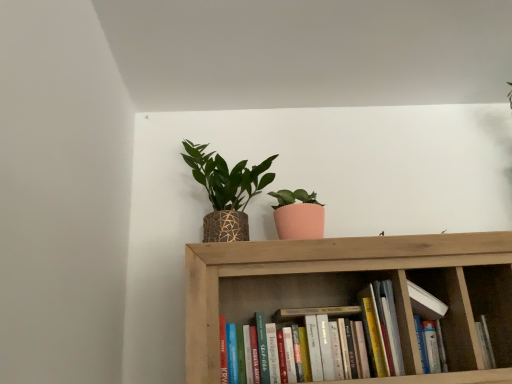
Question: Can we say wooden bookshelf at center lies outside textured woven pot at upper center?

Choices:
 (A) yes
 (B) no

Answer: (A)

Question: Does wooden bookshelf at center appear on the left side of textured woven pot at upper center?

Choices:
 (A) no
 (B) yes

Answer: (A)

Question: Is wooden bookshelf at center bigger than textured woven pot at upper center?

Choices:
 (A) no
 (B) yes

Answer: (B)

Question: Can you confirm if wooden bookshelf at center is shorter than textured woven pot at upper center?

Choices:
 (A) no
 (B) yes

Answer: (B)

Question: Is textured woven pot at upper center completely or partially inside wooden bookshelf at center?

Choices:
 (A) yes
 (B) no

Answer: (B)

Question: Is wooden bookshelf at center looking in the opposite direction of textured woven pot at upper center?

Choices:
 (A) no
 (B) yes

Answer: (A)

Question: Is hardcover books at center, placed as the 2th book when sorted from right to left, turned away from white matte book at center, which ranks as the 2th book in left-to-right order?

Choices:
 (A) yes
 (B) no

Answer: (B)

Question: Would you say white matte book at center, positioned as the first book in right-to-left order, is part of hardcover books at center, placed as the 2th book when sorted from right to left,'s contents?

Choices:
 (A) no
 (B) yes

Answer: (A)

Question: Is hardcover books at center, placed as the 2th book when sorted from right to left, not near white matte book at center, which ranks as the 2th book in left-to-right order?

Choices:
 (A) yes
 (B) no

Answer: (B)

Question: Considering the relative sizes of hardcover books at center, the 1th book in the left-to-right sequence, and white matte book at center, which ranks as the 2th book in left-to-right order, in the image provided, is hardcover books at center, the 1th book in the left-to-right sequence, bigger than white matte book at center, which ranks as the 2th book in left-to-right order,?

Choices:
 (A) no
 (B) yes

Answer: (B)

Question: Is hardcover books at center, placed as the 2th book when sorted from right to left, not inside white matte book at center, positioned as the first book in right-to-left order?

Choices:
 (A) yes
 (B) no

Answer: (A)

Question: Is hardcover books at center, placed as the 2th book when sorted from right to left, at the right side of white matte book at center, positioned as the first book in right-to-left order?

Choices:
 (A) yes
 (B) no

Answer: (B)

Question: Considering the relative positions of white matte book at center, which ranks as the 2th book in left-to-right order, and hardcover books at center, the 1th book in the left-to-right sequence, in the image provided, is white matte book at center, which ranks as the 2th book in left-to-right order, to the right of hardcover books at center, the 1th book in the left-to-right sequence, from the viewer's perspective?

Choices:
 (A) yes
 (B) no

Answer: (A)